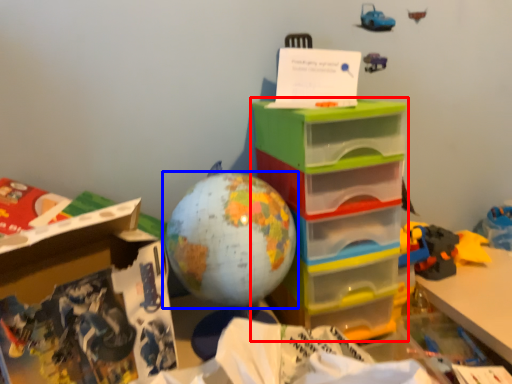
Question: Which object is further to the camera taking this photo, storage box (highlighted by a red box) or toy (highlighted by a blue box)?

Choices:
 (A) storage box
 (B) toy

Answer: (A)